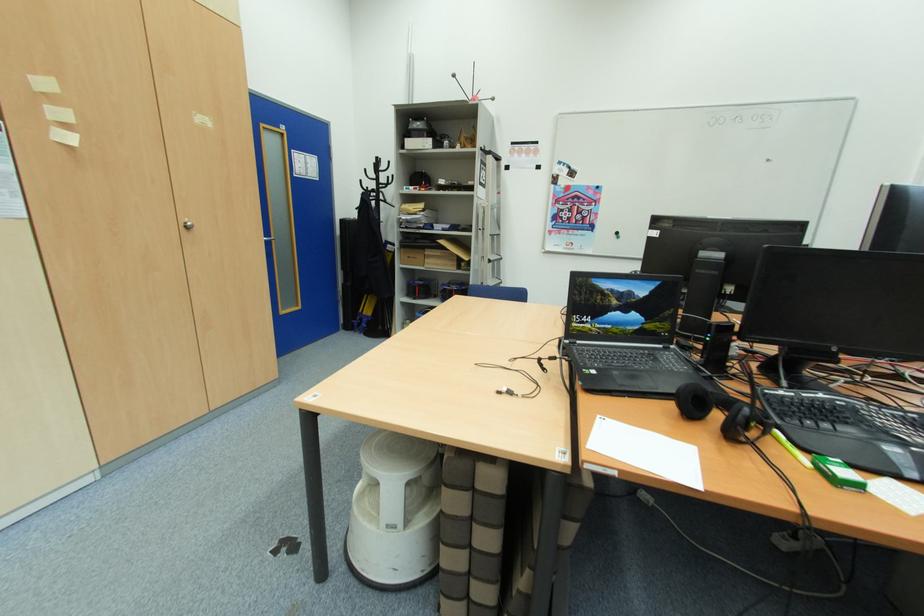
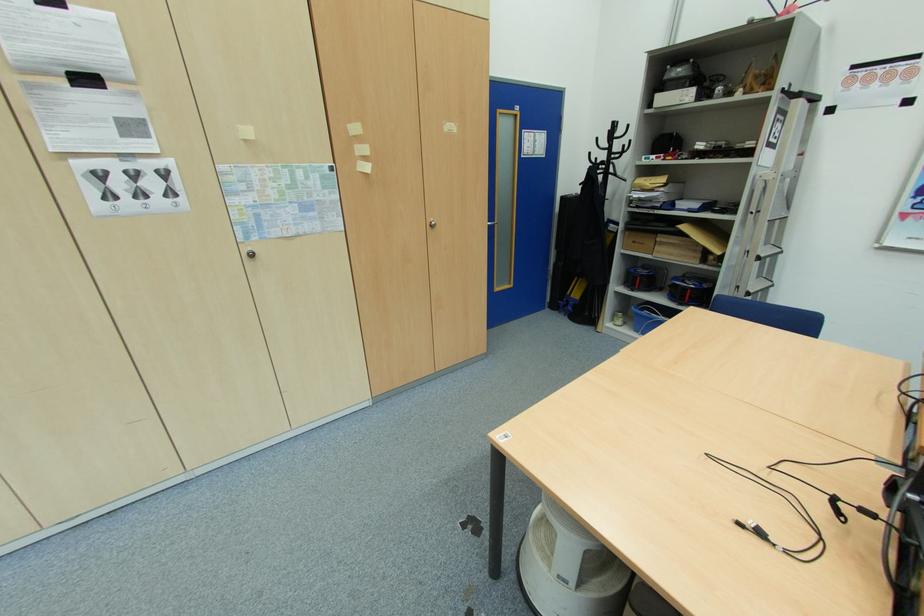
Where in the second image is the point corresponding to point (385, 198) from the first image?

(614, 169)